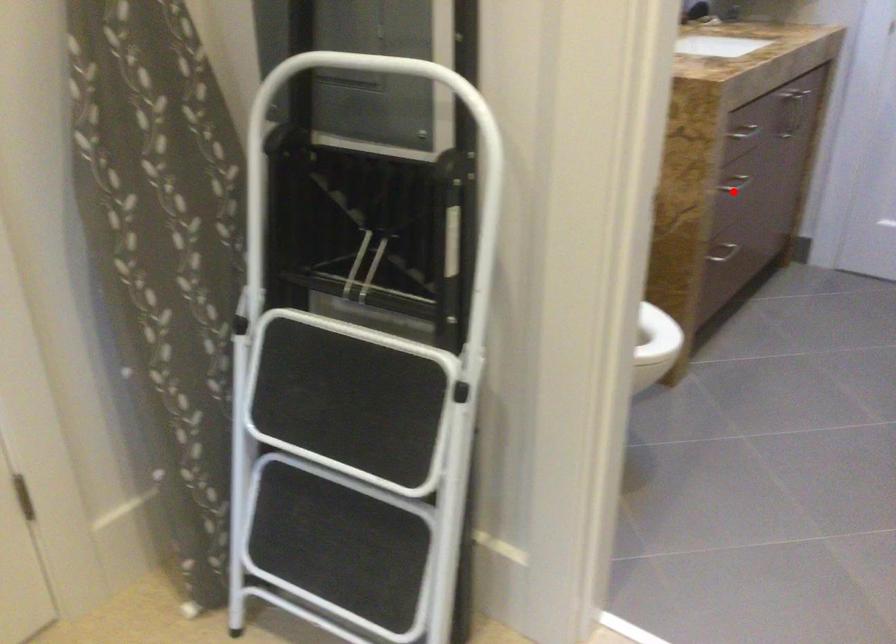
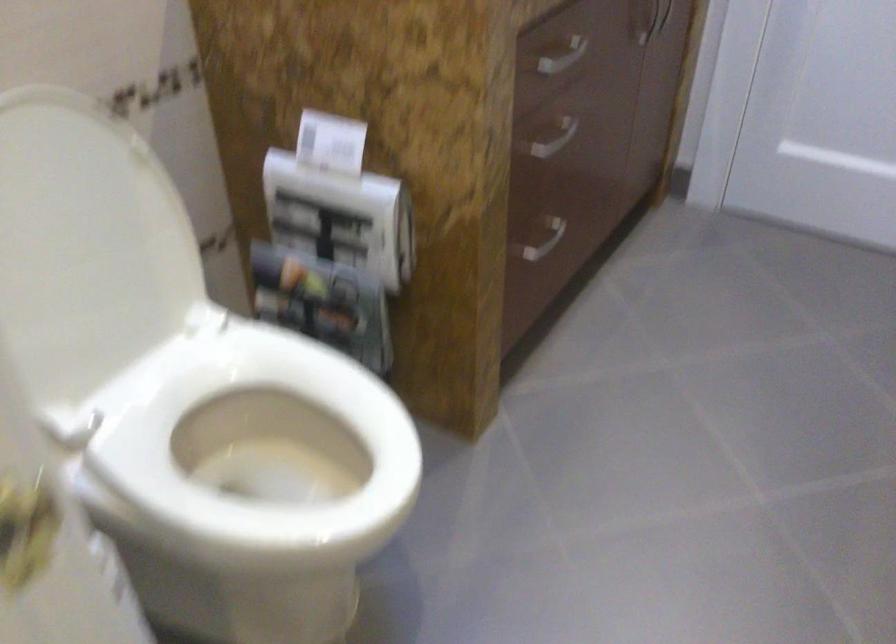
Question: I am providing you with two images of the same scene from different viewpoints. Given a red point in image1, look at the same physical point in image2. Is it:

Choices:
 (A) Closer to the viewpoint
 (B) Farther from the viewpoint

Answer: (A)